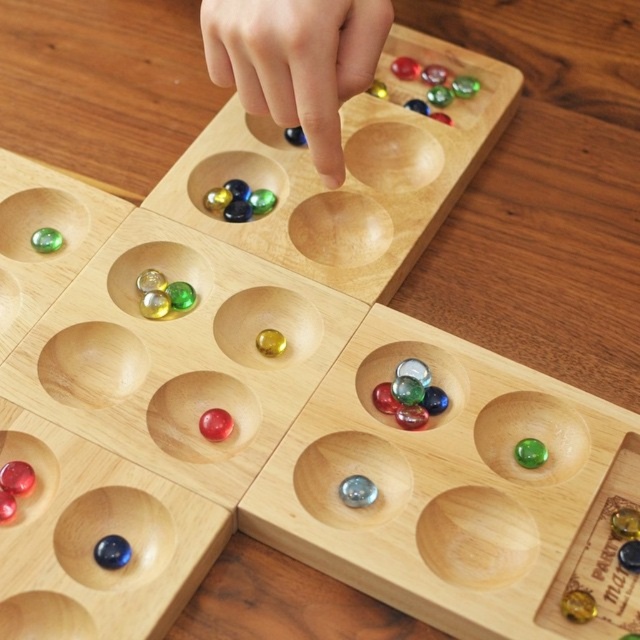
Consider the image. You are playing a game and need to place a marble into the board. Which group of marbles should you choose if you want to pick the taller ones between the shiny glass marbles at center and the translucent glass marbles at center left?

The shiny glass marbles at center are taller than the translucent glass marbles at center left, so you should choose the shiny glass marbles at center.

Looking at this image, you are playing a game with two types of marbles on the Mancala board. You have translucent glass marbles at center and shiny glass marbles at center. Which type of marble stack is taller?

The translucent glass marbles at center has a greater height compared to shiny glass marbles at center, so the translucent ones are taller.

You are standing in front of the Mancala game board. There is a point marked at coordinates (237, 200). What object is located at that point?

The point at coordinates (237, 200) corresponds to shiny glass marbles at center.